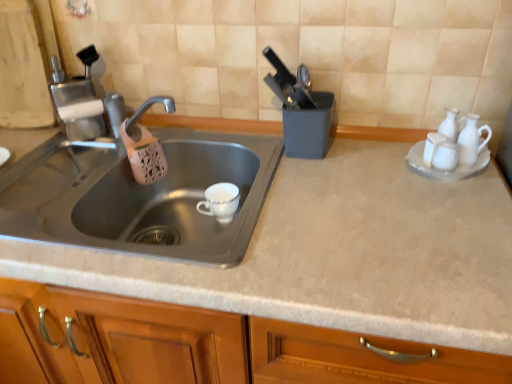
Find the location of a particular element. The width and height of the screenshot is (512, 384). vacant space to the left of white ceramic saucer at right is located at coordinates (369, 175).